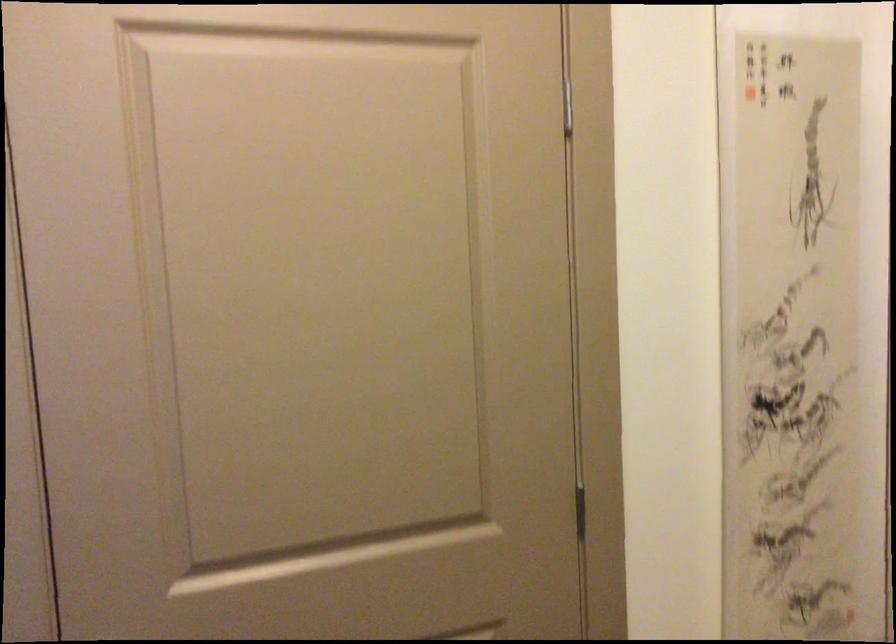
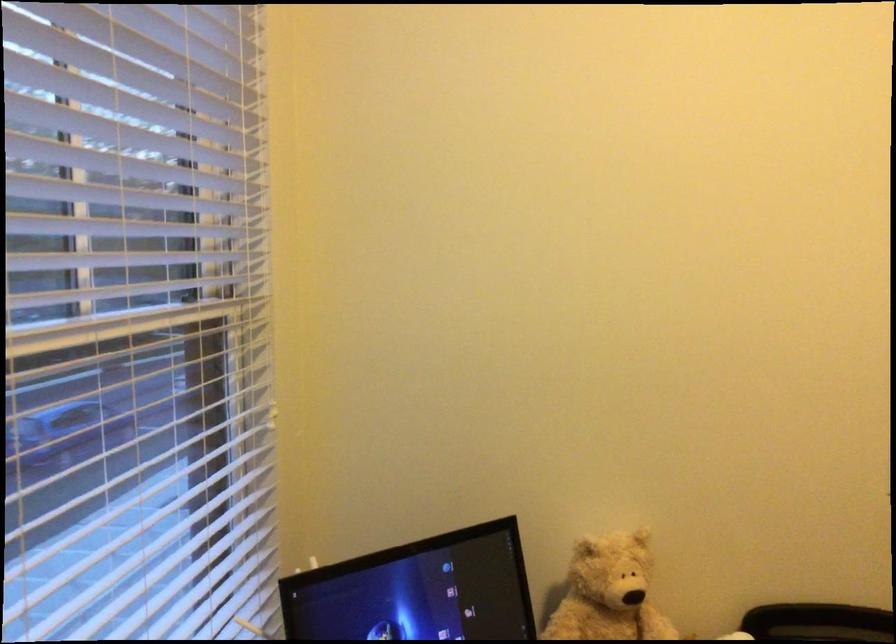
Question: The first image is from the beginning of the video and the second image is from the end. How did the camera likely rotate when shooting the video?

Choices:
 (A) Left
 (B) Right
 (C) Up
 (D) Down

Answer: (A)